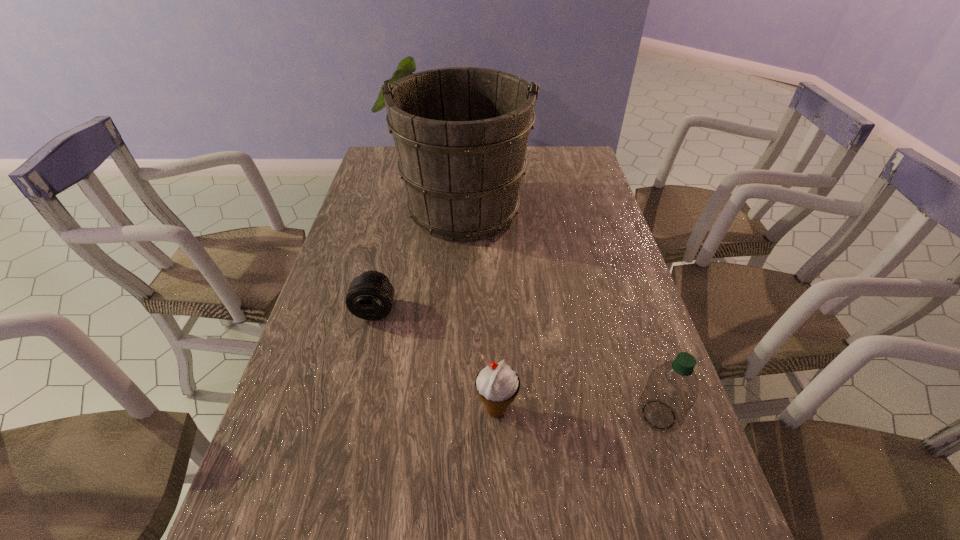
This screenshot has width=960, height=540. What are the coordinates of `vacant point located between the telephoto lens and the bucket` in the screenshot? It's located at (420, 259).

Locate an element on the screen. Image resolution: width=960 pixels, height=540 pixels. empty location between the rightmost object and the third tallest object is located at coordinates (578, 412).

Find the location of `unoccupied position between the second shortest object and the telephoto lens`. unoccupied position between the second shortest object and the telephoto lens is located at coordinates (436, 360).

Where is `unoccupied position between the farthest object and the second shortest object`? This screenshot has width=960, height=540. unoccupied position between the farthest object and the second shortest object is located at coordinates (480, 308).

Where is `free point between the tallest object and the third tallest object`? free point between the tallest object and the third tallest object is located at coordinates (480, 308).

Where is `vacant region between the water bottle and the second farthest object`? The width and height of the screenshot is (960, 540). vacant region between the water bottle and the second farthest object is located at coordinates (516, 362).

Identify the location of vacant region between the icecream and the farthest object. (480, 308).

Identify the location of free space between the second farthest object and the rightmost object. This screenshot has height=540, width=960. (516, 362).

Find the location of a particular element. The height and width of the screenshot is (540, 960). free space between the shortest object and the tallest object is located at coordinates (420, 259).

Select which object appears as the closest to the icecream. Please provide its 2D coordinates. Your answer should be formatted as a tuple, i.e. [(x, y)], where the tuple contains the x and y coordinates of a point satisfying the conditions above.

[(672, 389)]